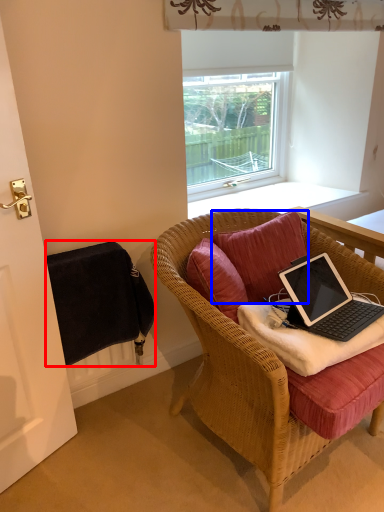
Question: Among these objects, which one is nearest to the camera, radiator (highlighted by a red box) or pillow (highlighted by a blue box)?

Choices:
 (A) radiator
 (B) pillow

Answer: (A)